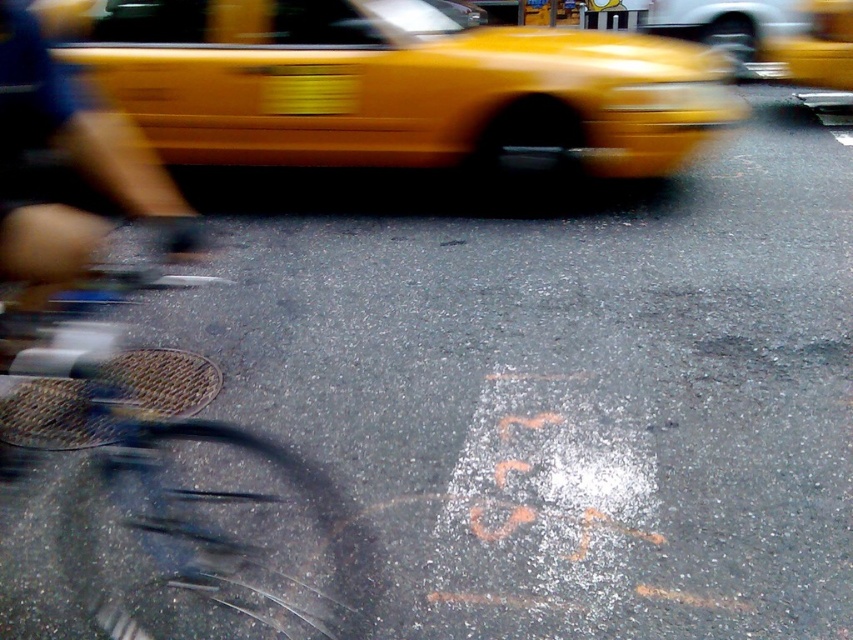
You are a delivery drone flying over an urban street scene. You need to land on the wet asphalt road in the foreground. However, there is a yellow plastic taxi at upper center in the image. Based on its position, can you safely land on the road without being too close to the taxi?

The yellow plastic taxi at upper center is located at point (393, 86), so you should be able to land safely on the wet asphalt road in the foreground as long as you avoid that specific coordinate.

You are a pedestrian standing on the sidewalk and looking at the yellow plastic taxi at upper center and the yellow rubber taxi at upper right. Which taxi is closer to you?

The yellow plastic taxi at upper center is closer to you because it is positioned under the yellow rubber taxi at upper right, meaning it is in front in the visual plane.

Looking at this image, you are a delivery person trying to navigate through the street shown in the image. You need to move your package from the blue metallic bicycle at lower left to the yellow rubber taxi at upper right. Considering their sizes, which object should you avoid bumping into to prevent damage?

The blue metallic bicycle at lower left has a larger size compared to the yellow rubber taxi at upper right, so you should avoid bumping into the blue metallic bicycle at lower left to prevent damage since it is larger and might be harder to maneuver around.